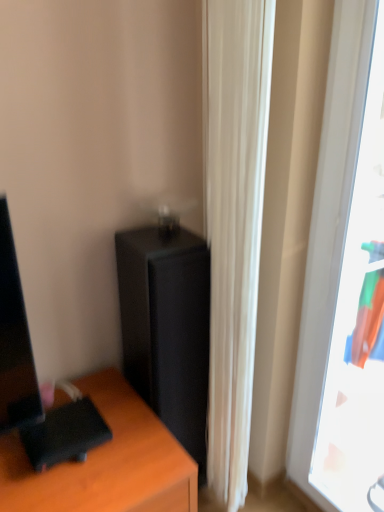
Question: From the image's perspective, is white fabric curtain at center positioned above or below transparent plastic window at right?

Choices:
 (A) below
 (B) above

Answer: (B)

Question: Relative to transparent plastic window at right, is white fabric curtain at center in front or behind?

Choices:
 (A) front
 (B) behind

Answer: (B)

Question: Which object is positioned farthest from the transparent plastic window at right?

Choices:
 (A) black matte/file cabinet at center
 (B) white fabric curtain at center

Answer: (A)

Question: Which object is the closest to the black matte/file cabinet at center?

Choices:
 (A) white fabric curtain at center
 (B) transparent plastic window at right

Answer: (A)